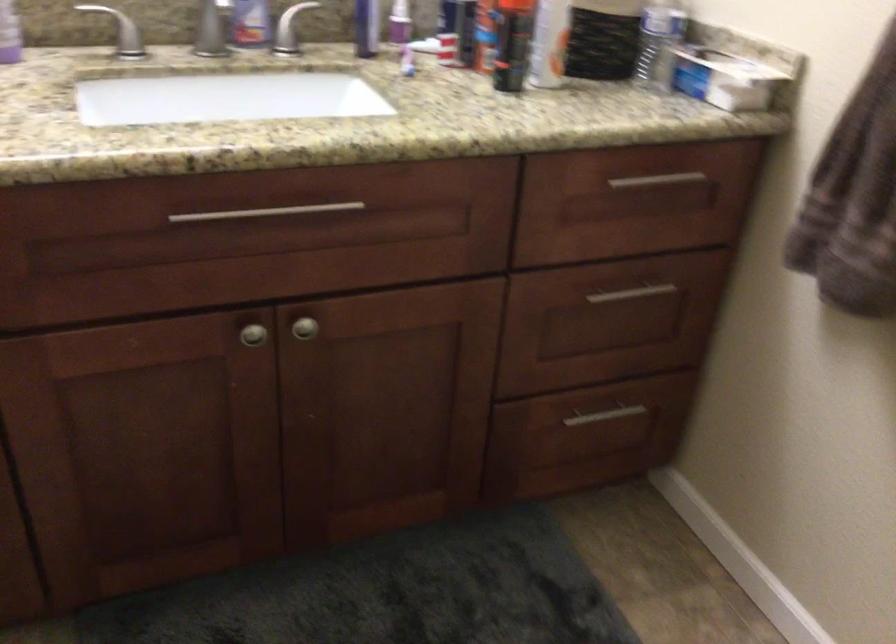
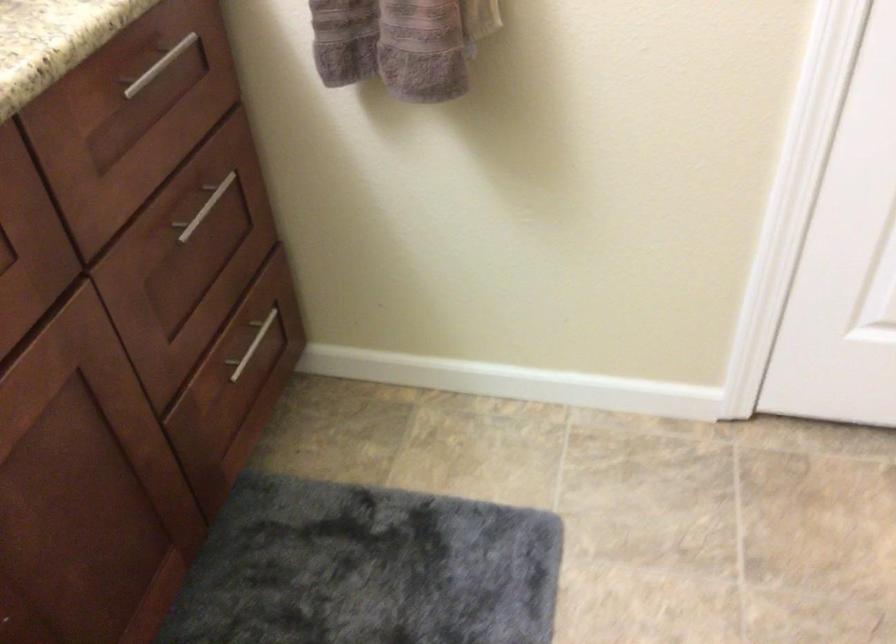
First-person continuous shooting, in which direction is the camera rotating?

The rotation direction of the camera is right-down.